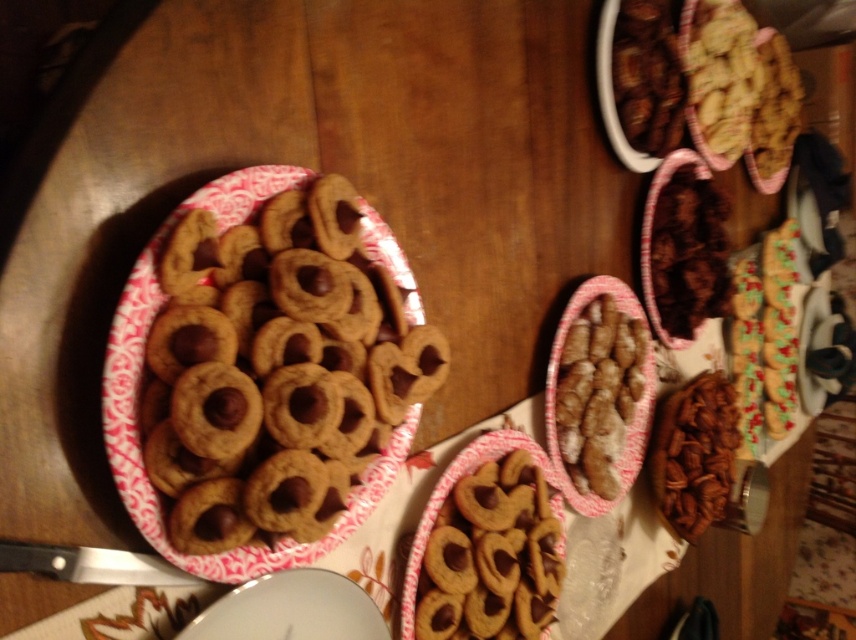
Question: Which point appears closest to the camera in this image?

Choices:
 (A) (620, 387)
 (B) (704, 12)
 (C) (153, 419)
 (D) (734, 413)

Answer: (C)

Question: Does golden brown cookie at upper right have a greater width compared to chocolate-coated nuts at center?

Choices:
 (A) no
 (B) yes

Answer: (B)

Question: Can you confirm if matte brown cookie at center is positioned below brown crunchy pecans at center?

Choices:
 (A) yes
 (B) no

Answer: (A)

Question: From the image, what is the correct spatial relationship of golden brown cookie dough at center in relation to brown crunchy pecans at center?

Choices:
 (A) left
 (B) right

Answer: (A)

Question: Which is farther from the golden brown cookie at upper right?

Choices:
 (A) chocolate-coated nuts at center
 (B) matte brown cookie at center

Answer: (B)

Question: Which object is the farthest from the chocolate-coated nuts at upper right?

Choices:
 (A) chocolate-coated nuts at center
 (B) brown crunchy pecans at center
 (C) brown crumbly cookie at center
 (D) golden brown cookie at upper right

Answer: (B)